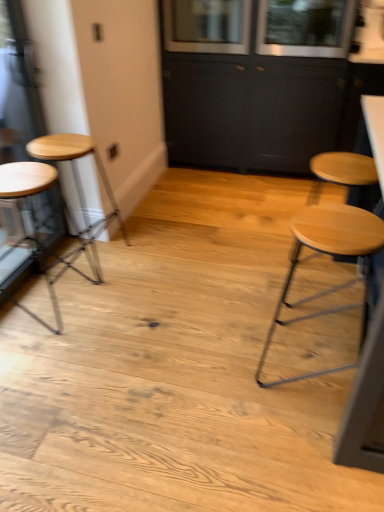
Question: From the image's perspective, is clear glass window at upper center, placed as the 2th window when sorted from left to right, under light wood stool at right, which appears as the 3th stool when viewed from the left?

Choices:
 (A) yes
 (B) no

Answer: (B)

Question: Can you confirm if clear glass window at upper center, placed as the 2th window when sorted from left to right, is wider than light wood stool at right, which appears as the 3th stool when viewed from the left?

Choices:
 (A) yes
 (B) no

Answer: (A)

Question: Could light wood stool at right, which appears as the first stool when viewed from the right, be considered to be inside clear glass window at upper center, the first window from the right?

Choices:
 (A) yes
 (B) no

Answer: (B)

Question: Considering the relative sizes of clear glass window at upper center, placed as the 2th window when sorted from left to right, and light wood stool at right, which appears as the 3th stool when viewed from the left, in the image provided, is clear glass window at upper center, placed as the 2th window when sorted from left to right, bigger than light wood stool at right, which appears as the 3th stool when viewed from the left,?

Choices:
 (A) no
 (B) yes

Answer: (B)

Question: Is clear glass window at upper center, placed as the 2th window when sorted from left to right, oriented away from light wood stool at right, which appears as the first stool when viewed from the right?

Choices:
 (A) no
 (B) yes

Answer: (A)

Question: Are clear glass window at upper center, the first window from the right, and light wood stool at right, which appears as the first stool when viewed from the right, making contact?

Choices:
 (A) yes
 (B) no

Answer: (B)

Question: From the image's perspective, is light brown wood stool at left, which appears as the second stool when viewed from the left, above clear glass window at upper center, placed as the 2th window when sorted from left to right?

Choices:
 (A) no
 (B) yes

Answer: (A)

Question: Is light brown wood stool at left, which appears as the second stool when viewed from the left, shorter than clear glass window at upper center, placed as the 2th window when sorted from left to right?

Choices:
 (A) yes
 (B) no

Answer: (B)

Question: Can you confirm if light brown wood stool at left, placed as the second stool when sorted from right to left, is smaller than clear glass window at upper center, the first window from the right?

Choices:
 (A) no
 (B) yes

Answer: (B)

Question: Is there a large distance between light brown wood stool at left, placed as the second stool when sorted from right to left, and clear glass window at upper center, the first window from the right?

Choices:
 (A) yes
 (B) no

Answer: (A)

Question: Does light brown wood stool at left, which appears as the second stool when viewed from the left, have a lesser width compared to clear glass window at upper center, placed as the 2th window when sorted from left to right?

Choices:
 (A) yes
 (B) no

Answer: (A)

Question: Is light brown wood stool at left, placed as the second stool when sorted from right to left, placed right next to clear glass window at upper center, placed as the 2th window when sorted from left to right?

Choices:
 (A) no
 (B) yes

Answer: (A)

Question: From the image's perspective, is light wood stool at right, which appears as the 3th stool when viewed from the left, under wooden stool at left, the third stool in the right-to-left sequence?

Choices:
 (A) no
 (B) yes

Answer: (B)